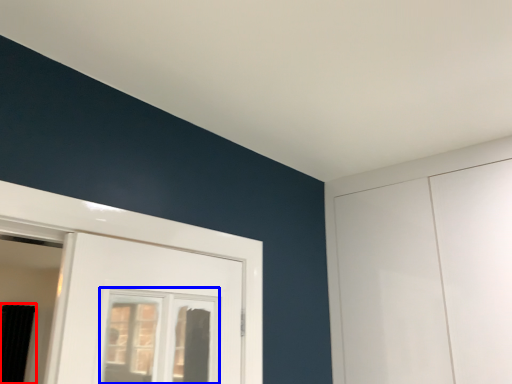
Question: Which point is closer to the camera, curtain (highlighted by a red box) or window (highlighted by a blue box)?

Choices:
 (A) curtain
 (B) window

Answer: (B)